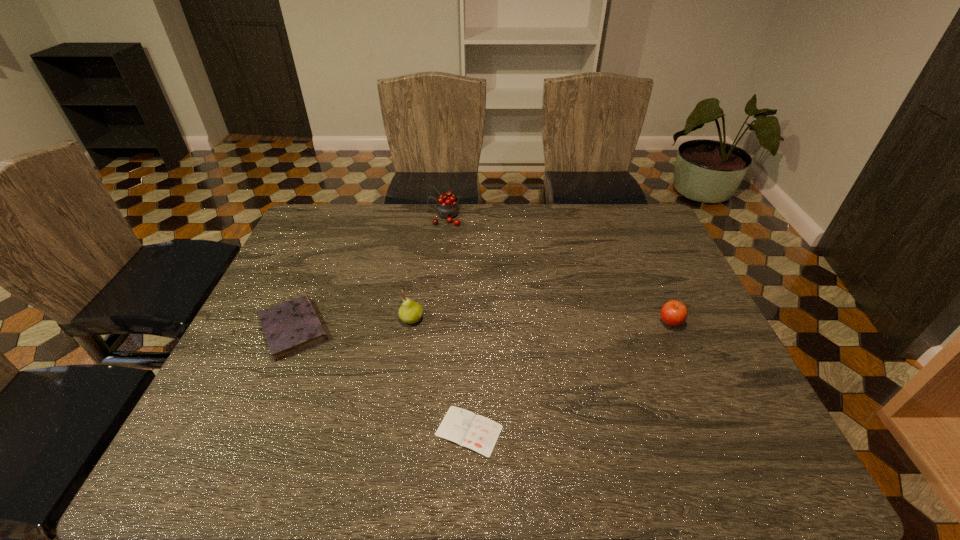
I want to click on free spot located 0.080m on the handle side of the cherry, so click(x=405, y=217).

Find the location of `vacant space located on the back of the pear`. vacant space located on the back of the pear is located at coordinates (417, 288).

Find the location of a particular element. The image size is (960, 540). vacant space located 0.320m on the back of the rightmost object is located at coordinates (636, 242).

Find the location of a particular element. vacant space positioned 0.150m on the back of the fourth tallest object is located at coordinates (321, 266).

Image resolution: width=960 pixels, height=540 pixels. I want to click on vacant space situated 0.050m on the left of the nearest object, so click(x=411, y=431).

I want to click on object situated at the far edge, so click(x=447, y=207).

Where is `object present at the near edge`? The width and height of the screenshot is (960, 540). object present at the near edge is located at coordinates (478, 433).

You are a GUI agent. You are given a task and a screenshot of the screen. Output one action in this format:
    pyautogui.click(x=<x>, y=<y>)
    Task: Click on the object located at the left edge
    
    Given the screenshot: What is the action you would take?
    pyautogui.click(x=293, y=326)

Where is `object that is at the right edge`? The image size is (960, 540). object that is at the right edge is located at coordinates (674, 313).

Image resolution: width=960 pixels, height=540 pixels. What are the coordinates of `vacant space at the far edge of the desktop` in the screenshot? It's located at (508, 226).